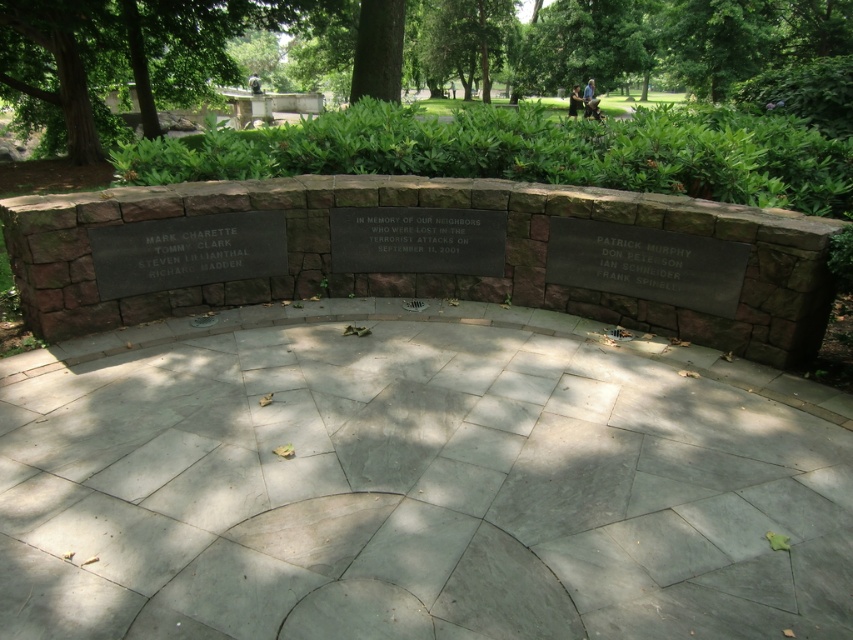
From the picture: You are a maintenance worker tasked with cleaning the memorial plaques. You have a 3.5 feet long cleaning tool. Can you reach from the black polished stone plaque at center to the black polished stone plaque at right without moving your position?

The distance between the black polished stone plaque at center and the black polished stone plaque at right is 3.46 feet. Since your tool is 3.5 feet long, you can just barely reach from the black polished stone plaque at center to the black polished stone plaque at right without moving your position.

You are a visitor at the memorial and want to take a photo of the green leafy tree at upper left and the black stone plaque at center. Which object should you frame first in your camera to ensure both are in the shot?

The green leafy tree at upper left should be framed first since it is positioned on the left side of the black stone plaque at center, ensuring both are included in the photo.